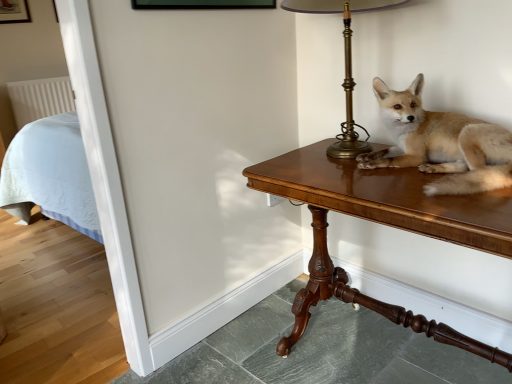
Question: From a real-world perspective, is brass lampshade at upper right located beneath light brown fur at center?

Choices:
 (A) yes
 (B) no

Answer: (B)

Question: From a real-world perspective, is brass lampshade at upper right on top of light brown fur at center?

Choices:
 (A) yes
 (B) no

Answer: (A)

Question: Does brass lampshade at upper right have a greater height compared to light brown fur at center?

Choices:
 (A) yes
 (B) no

Answer: (A)

Question: Could light brown fur at center be considered to be inside brass lampshade at upper right?

Choices:
 (A) no
 (B) yes

Answer: (A)

Question: Is brass lampshade at upper right facing towards light brown fur at center?

Choices:
 (A) no
 (B) yes

Answer: (A)

Question: Does brass lampshade at upper right have a lesser height compared to light brown fur at center?

Choices:
 (A) no
 (B) yes

Answer: (A)

Question: Can you confirm if wooden table at right is bigger than light brown fur at center?

Choices:
 (A) no
 (B) yes

Answer: (B)

Question: Can you confirm if wooden table at right is wider than light brown fur at center?

Choices:
 (A) yes
 (B) no

Answer: (A)

Question: Is wooden table at right closer to camera compared to light brown fur at center?

Choices:
 (A) no
 (B) yes

Answer: (B)

Question: Does wooden table at right have a lesser height compared to light brown fur at center?

Choices:
 (A) no
 (B) yes

Answer: (A)

Question: Is wooden table at right positioned with its back to light brown fur at center?

Choices:
 (A) no
 (B) yes

Answer: (A)

Question: Does wooden table at right appear on the right side of light brown fur at center?

Choices:
 (A) no
 (B) yes

Answer: (A)

Question: Considering the relative sizes of wooden table at right and brass lampshade at upper right in the image provided, is wooden table at right bigger than brass lampshade at upper right?

Choices:
 (A) no
 (B) yes

Answer: (B)